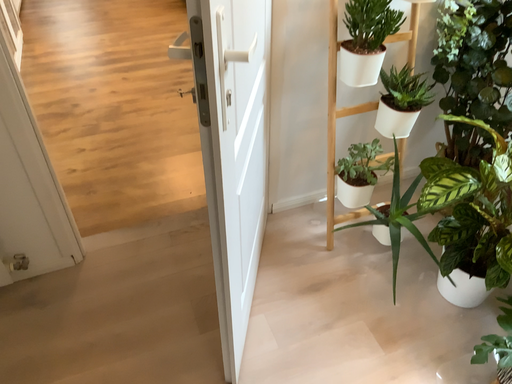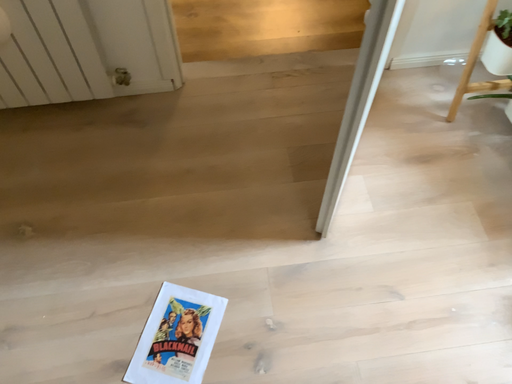
Question: How did the camera likely rotate when shooting the video?

Choices:
 (A) rotated downward
 (B) rotated upward

Answer: (A)